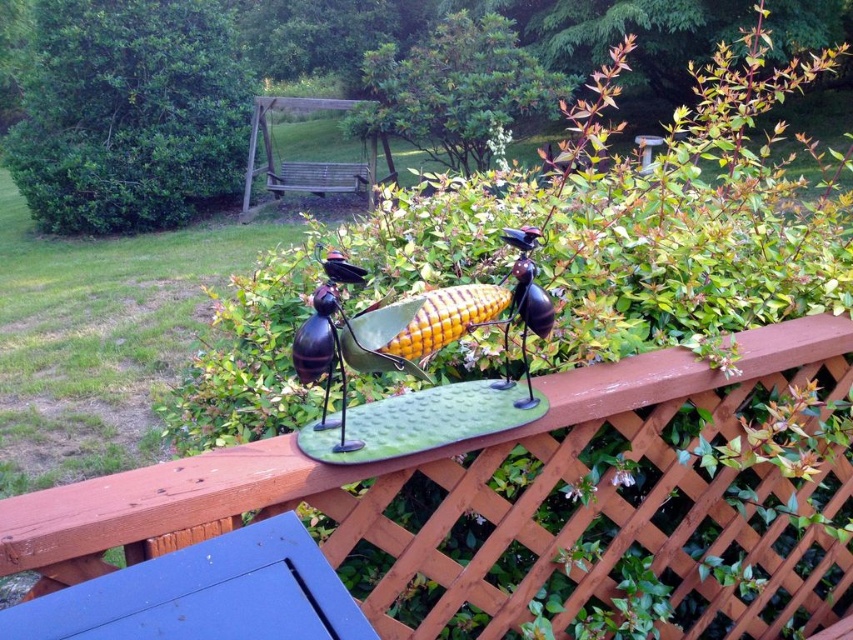
You are designing a garden layout and want to place a new decorative sculpture between the green leafy bush at upper left and the green leafy bush at upper center. Considering their widths, which bush is wider and should you consider its space when positioning the sculpture?

The green leafy bush at upper left is wider than the green leafy bush at upper center, so you should consider its space when positioning the sculpture.